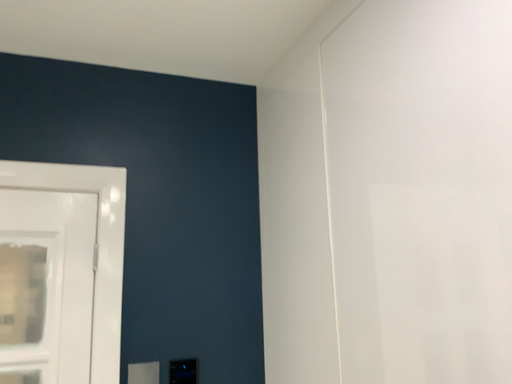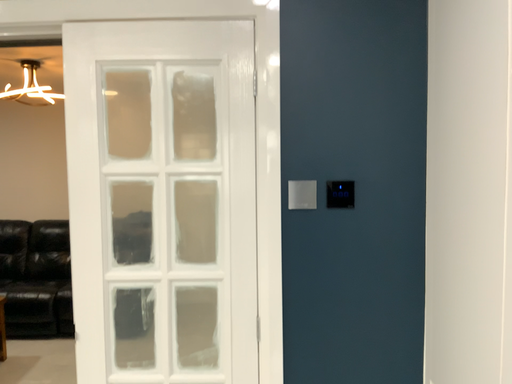
Question: How did the camera likely rotate when shooting the video?

Choices:
 (A) rotated right
 (B) rotated left

Answer: (B)